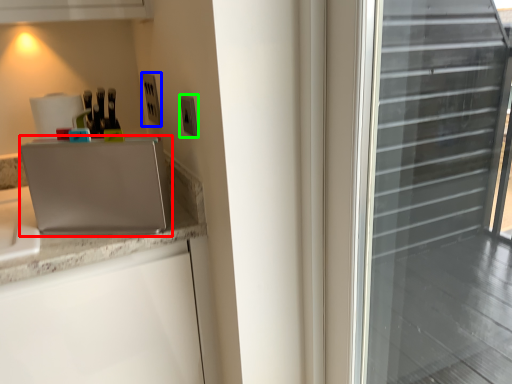
Question: Considering the real-world distances, which object is closest to appliance (highlighted by a red box)? electric outlet (highlighted by a blue box) or electric outlet (highlighted by a green box).

Choices:
 (A) electric outlet
 (B) electric outlet

Answer: (B)